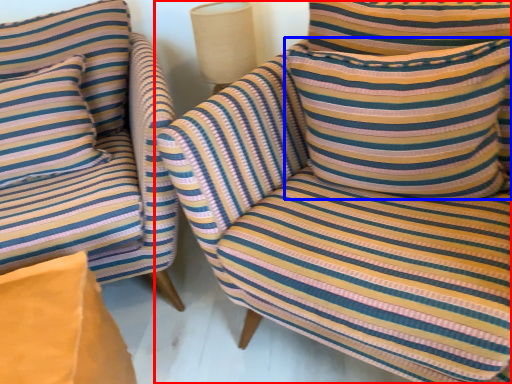
Question: Which object appears closest to the camera in this image, chair (highlighted by a red box) or pillow (highlighted by a blue box)?

Choices:
 (A) chair
 (B) pillow

Answer: (A)